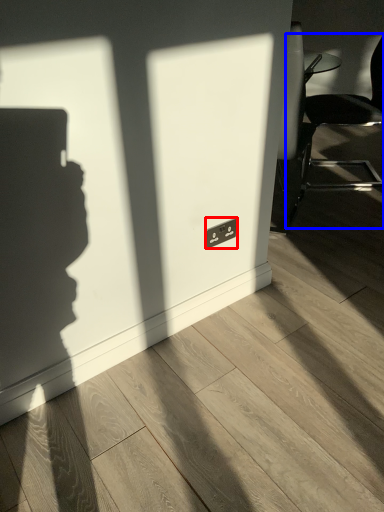
Question: Which point is further to the camera, electric outlet (highlighted by a red box) or chair (highlighted by a blue box)?

Choices:
 (A) electric outlet
 (B) chair

Answer: (B)